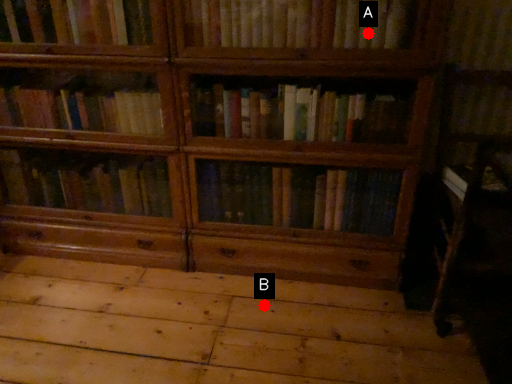
Question: Two points are circled on the image, labeled by A and B beside each circle. Among these points, which one is nearest to the camera?

Choices:
 (A) A is closer
 (B) B is closer

Answer: (A)